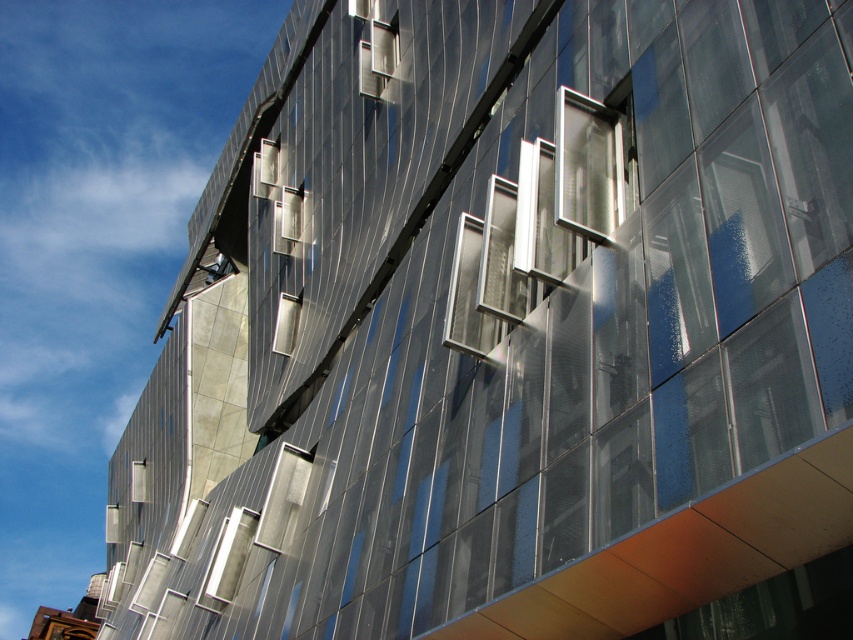
Consider the image. You are an architect analyzing the building facade. You notice the clear glass window at center and the metallic silver window at upper center. Which window has a larger vertical dimension?

The clear glass window at center has a greater height compared to the metallic silver window at upper center, so it has a larger vertical dimension.